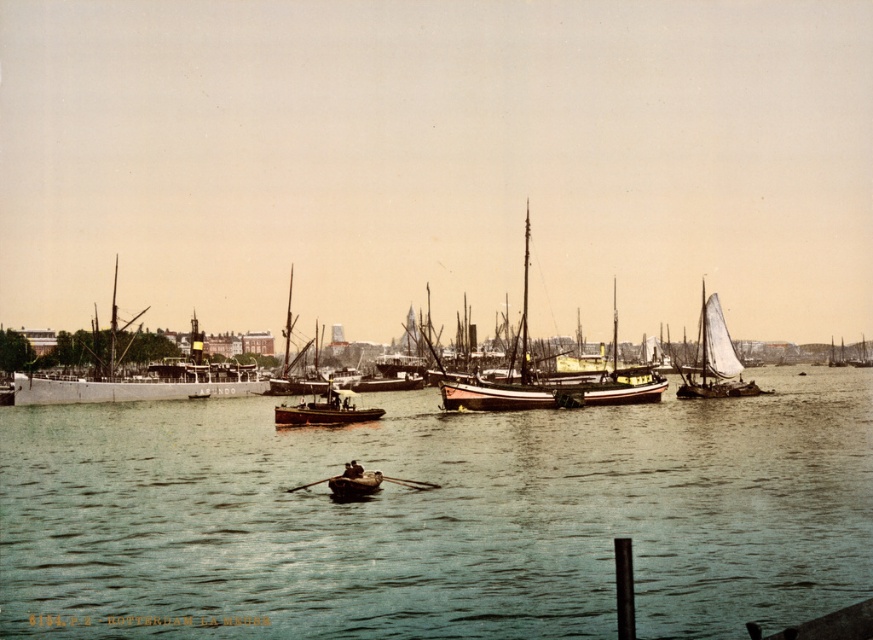
You are a harbor worker who needs to move a 40 meter long cargo ship through the harbor. The wooden boat at center and the wooden rowboat at center are in your path. Can you safely navigate your cargo ship between them?

The distance between the wooden boat at center and the wooden rowboat at center is 39.41 meters. Since your cargo ship is 40 meters long, it cannot safely navigate between them as the gap is slightly narrower than the ship.

Consider the image. What is located at the coordinates point (438,516) in the harbor scene?

The greenish water at center is located at point (438,516).

You are standing on the dock and want to throw a small floating toy into the greenish water at center. What are the coordinates where you should aim?

You should aim at the coordinates point (438,516) to target the greenish water at center.